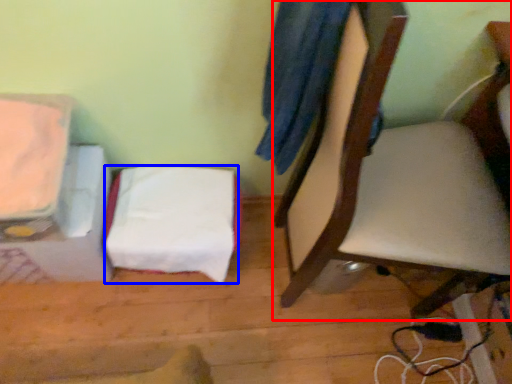
Question: Which point is closer to the camera, chair (highlighted by a red box) or sheet (highlighted by a blue box)?

Choices:
 (A) chair
 (B) sheet

Answer: (A)